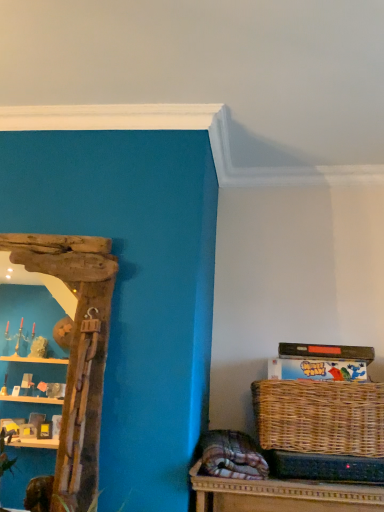
Question: From a real-world perspective, is woven brown picnic basket at lower right over driftwood mirror at left?

Choices:
 (A) no
 (B) yes

Answer: (A)

Question: Is woven brown picnic basket at lower right outside driftwood mirror at left?

Choices:
 (A) yes
 (B) no

Answer: (A)

Question: From a real-world perspective, is woven brown picnic basket at lower right physically below driftwood mirror at left?

Choices:
 (A) yes
 (B) no

Answer: (A)

Question: Is driftwood mirror at left surrounded by woven brown picnic basket at lower right?

Choices:
 (A) yes
 (B) no

Answer: (B)

Question: Is woven brown picnic basket at lower right oriented away from driftwood mirror at left?

Choices:
 (A) yes
 (B) no

Answer: (B)

Question: Considering the relative sizes of woven brown picnic basket at lower right and driftwood mirror at left in the image provided, is woven brown picnic basket at lower right wider than driftwood mirror at left?

Choices:
 (A) yes
 (B) no

Answer: (A)

Question: From the image's perspective, is driftwood mirror at left on top of woven brown picnic basket at lower right?

Choices:
 (A) no
 (B) yes

Answer: (B)

Question: Is driftwood mirror at left taller than woven brown picnic basket at lower right?

Choices:
 (A) no
 (B) yes

Answer: (B)

Question: From a real-world perspective, is driftwood mirror at left on top of woven brown picnic basket at lower right?

Choices:
 (A) no
 (B) yes

Answer: (B)

Question: Is driftwood mirror at left positioned far away from woven brown picnic basket at lower right?

Choices:
 (A) yes
 (B) no

Answer: (B)

Question: Is woven brown picnic basket at lower right surrounded by driftwood mirror at left?

Choices:
 (A) yes
 (B) no

Answer: (B)

Question: Is driftwood mirror at left directly adjacent to woven brown picnic basket at lower right?

Choices:
 (A) yes
 (B) no

Answer: (B)

Question: Looking at the image, does driftwood mirror at left seem bigger or smaller compared to woven brown picnic basket at lower right?

Choices:
 (A) small
 (B) big

Answer: (A)